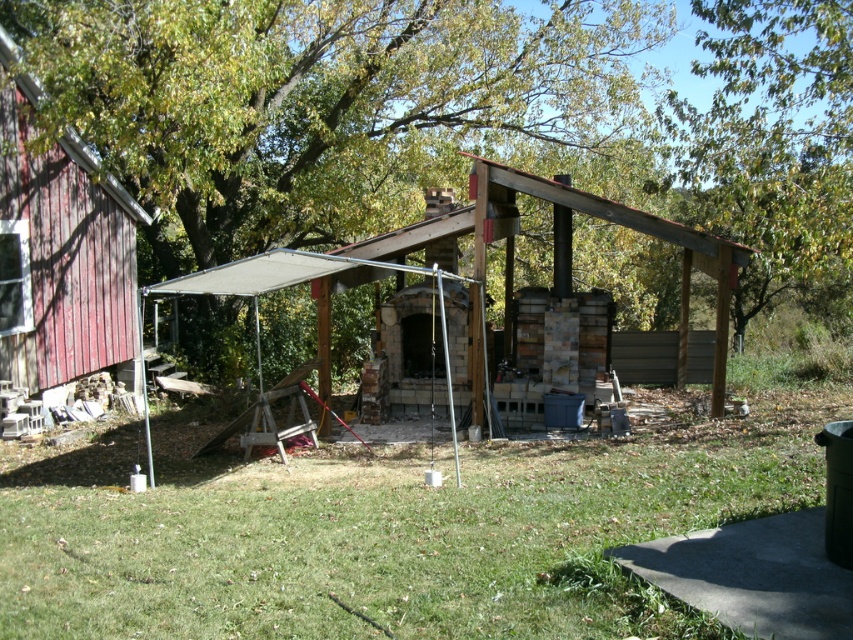
Question: Which of these objects is positioned closest to the green leafy tree at upper center?

Choices:
 (A) wooden pergola at center
 (B) grass at lower center
 (C) rusty wood hut at left

Answer: (A)

Question: Where is grass at lower center located in relation to green leafy tree at upper center in the image?

Choices:
 (A) below
 (B) above

Answer: (A)

Question: Which of the following is the closest to the observer?

Choices:
 (A) (726, 74)
 (B) (125, 454)
 (C) (44, 384)

Answer: (B)

Question: Is grass at lower center bigger than rusty wood hut at left?

Choices:
 (A) no
 (B) yes

Answer: (B)

Question: Does grass at lower center appear on the left side of wooden pergola at center?

Choices:
 (A) yes
 (B) no

Answer: (B)

Question: Which object is farther from the camera taking this photo?

Choices:
 (A) grass at lower center
 (B) rusty wood hut at left
 (C) green leafy tree at upper center

Answer: (B)